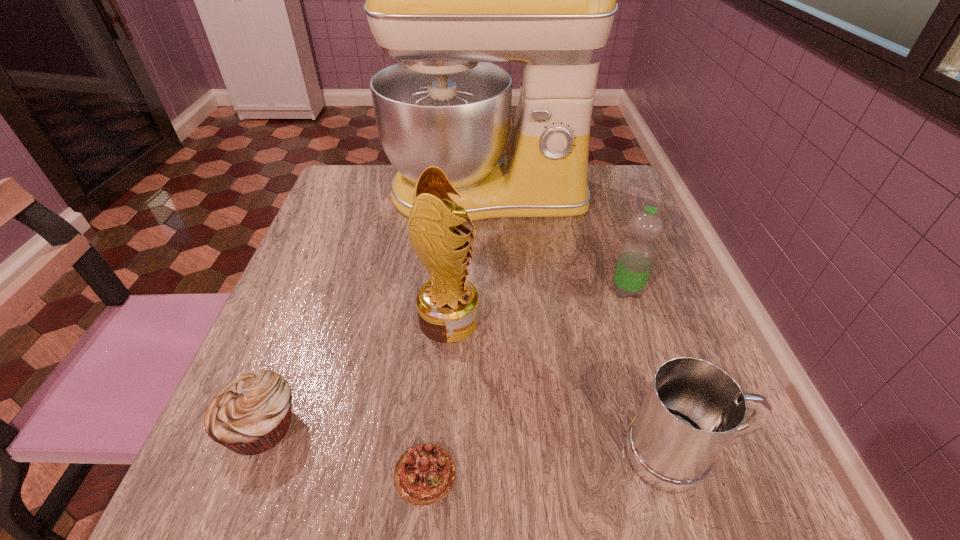
I want to click on blank space located 0.250m on the back of the water bottle, so click(x=599, y=211).

Locate an element on the screen. The height and width of the screenshot is (540, 960). vacant space situated on the back of the muffin is located at coordinates (330, 248).

I want to click on free space located 0.060m on the back of the shortest object, so click(431, 407).

You are a GUI agent. You are given a task and a screenshot of the screen. Output one action in this format:
    pyautogui.click(x=<x>, y=<y>)
    Task: Click on the object that is at the far edge
    This screenshot has width=960, height=540.
    Given the screenshot: What is the action you would take?
    pyautogui.click(x=446, y=0)

Where is `mug present at the near edge`? mug present at the near edge is located at coordinates (692, 409).

Find the location of a particular element. This screenshot has width=960, height=540. muffin at the near edge is located at coordinates (250, 415).

Identify the location of chocolate cake at the near edge. This screenshot has height=540, width=960. tap(424, 474).

This screenshot has height=540, width=960. What are the coordinates of `mixer present at the left edge` in the screenshot? It's located at click(446, 0).

Where is `muffin at the left edge`? Image resolution: width=960 pixels, height=540 pixels. muffin at the left edge is located at coordinates (250, 415).

This screenshot has height=540, width=960. Identify the location of mixer that is positioned at the right edge. (446, 0).